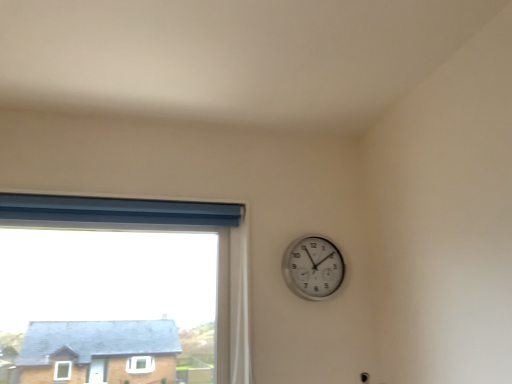
Where is `blue fabric window at upper left`? This screenshot has height=384, width=512. blue fabric window at upper left is located at coordinates (162, 230).

What do you see at coordinates (162, 230) in the screenshot?
I see `blue fabric window at upper left` at bounding box center [162, 230].

The image size is (512, 384). Describe the element at coordinates (313, 267) in the screenshot. I see `silver metallic wall clock at upper right` at that location.

You are a GUI agent. You are given a task and a screenshot of the screen. Output one action in this format:
    pyautogui.click(x=<x>, y=<y>)
    Task: Click on the silver metallic wall clock at upper right
    This screenshot has height=384, width=512.
    Given the screenshot: What is the action you would take?
    pyautogui.click(x=313, y=267)

Where is `blue fabric window at upper left`? blue fabric window at upper left is located at coordinates (162, 230).

Between silver metallic wall clock at upper right and blue fabric window at upper left, which one appears on the right side from the viewer's perspective?

silver metallic wall clock at upper right is more to the right.

Is the position of silver metallic wall clock at upper right less distant than that of blue fabric window at upper left?

No, silver metallic wall clock at upper right is further to the viewer.

Considering the positions of points (298, 257) and (231, 247), is point (298, 257) closer to camera compared to point (231, 247)?

Yes, it is.

From the image's perspective, relative to blue fabric window at upper left, is silver metallic wall clock at upper right above or below?

silver metallic wall clock at upper right is situated higher than blue fabric window at upper left in the image.

From a real-world perspective, which is physically below, silver metallic wall clock at upper right or blue fabric window at upper left?

blue fabric window at upper left.

Which of these two, silver metallic wall clock at upper right or blue fabric window at upper left, is thinner?

With smaller width is silver metallic wall clock at upper right.

Considering the sizes of silver metallic wall clock at upper right and blue fabric window at upper left in the image, is silver metallic wall clock at upper right taller or shorter than blue fabric window at upper left?

Clearly, silver metallic wall clock at upper right is shorter compared to blue fabric window at upper left.

Between silver metallic wall clock at upper right and blue fabric window at upper left, which one has smaller size?

silver metallic wall clock at upper right.

Would you say silver metallic wall clock at upper right is inside or outside blue fabric window at upper left?

silver metallic wall clock at upper right exists outside the volume of blue fabric window at upper left.

Is silver metallic wall clock at upper right not near blue fabric window at upper left?

No, silver metallic wall clock at upper right is in close proximity to blue fabric window at upper left.

Is silver metallic wall clock at upper right positioned with its back to blue fabric window at upper left?

That's not correct — silver metallic wall clock at upper right is not looking away from blue fabric window at upper left.

I want to click on wall clock located above the blue fabric window at upper left (from the image's perspective), so click(313, 267).

From the picture: Considering the relative positions of blue fabric window at upper left and silver metallic wall clock at upper right in the image provided, is blue fabric window at upper left to the right of silver metallic wall clock at upper right from the viewer's perspective?

Incorrect, blue fabric window at upper left is not on the right side of silver metallic wall clock at upper right.

In the image, is blue fabric window at upper left positioned in front of or behind silver metallic wall clock at upper right?

Visually, blue fabric window at upper left is located in front of silver metallic wall clock at upper right.

Which is in front, point (160, 216) or point (315, 240)?

Positioned in front is point (160, 216).

From the image's perspective, would you say blue fabric window at upper left is positioned over silver metallic wall clock at upper right?

No, from the image's perspective, blue fabric window at upper left is not on top of silver metallic wall clock at upper right.

From a real-world perspective, is blue fabric window at upper left positioned over silver metallic wall clock at upper right based on gravity?

No, from a real-world perspective, blue fabric window at upper left is not over silver metallic wall clock at upper right

Between blue fabric window at upper left and silver metallic wall clock at upper right, which one has larger width?

Wider between the two is blue fabric window at upper left.

From the picture: Which of these two, blue fabric window at upper left or silver metallic wall clock at upper right, stands taller?

blue fabric window at upper left is taller.

Who is smaller, blue fabric window at upper left or silver metallic wall clock at upper right?

Smaller between the two is silver metallic wall clock at upper right.

Is silver metallic wall clock at upper right surrounded by blue fabric window at upper left?

Actually, silver metallic wall clock at upper right is outside blue fabric window at upper left.

Would you say blue fabric window at upper left is a long distance from silver metallic wall clock at upper right?

Actually, blue fabric window at upper left and silver metallic wall clock at upper right are a little close together.

Could you tell me if blue fabric window at upper left is facing silver metallic wall clock at upper right?

No, blue fabric window at upper left is not aimed at silver metallic wall clock at upper right.

In the scene shown: Measure the distance from blue fabric window at upper left to silver metallic wall clock at upper right.

They are 14.31 inches apart.

Where is `wall clock behind the blue fabric window at upper left`? This screenshot has width=512, height=384. wall clock behind the blue fabric window at upper left is located at coordinates (313, 267).

What are the coordinates of `window below the silver metallic wall clock at upper right (from the image's perspective)` in the screenshot? It's located at 162,230.

Locate an element on the screen. This screenshot has height=384, width=512. window lying in front of the silver metallic wall clock at upper right is located at coordinates (162, 230).